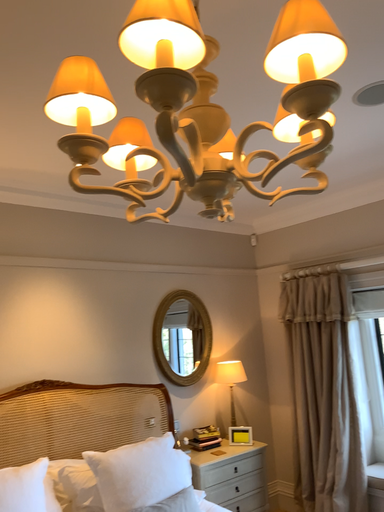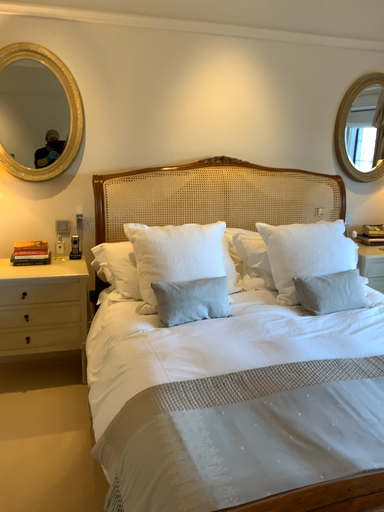
Question: Which way did the camera rotate in the video?

Choices:
 (A) rotated right
 (B) rotated left

Answer: (B)